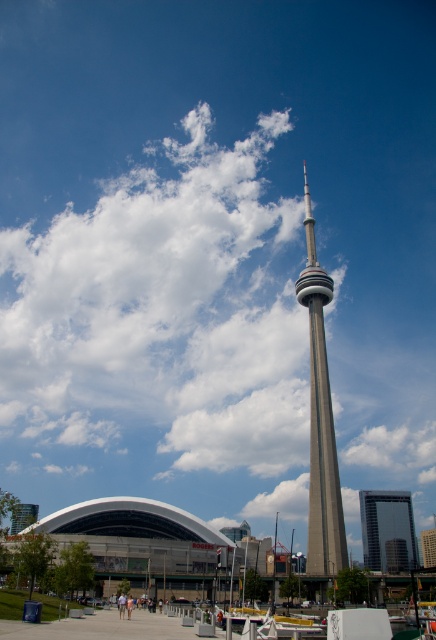
Question: Which point is closer to the camera?

Choices:
 (A) (392, 532)
 (B) (344, 541)
 (C) (210, 147)

Answer: (B)

Question: Can you confirm if white fluffy cloud at upper center is positioned below silver metallic cn tower at center?

Choices:
 (A) yes
 (B) no

Answer: (B)

Question: Which object is farther from the camera taking this photo?

Choices:
 (A) glassy reflective skyscraper at center
 (B) white fluffy cloud at upper center

Answer: (A)

Question: Does white fluffy cloud at upper center appear on the right side of glassy reflective skyscraper at center?

Choices:
 (A) yes
 (B) no

Answer: (B)

Question: Is white fluffy cloud at upper center positioned before glassy reflective skyscraper at center?

Choices:
 (A) no
 (B) yes

Answer: (B)

Question: Which object is the farthest from the silver metallic cn tower at center?

Choices:
 (A) glassy reflective skyscraper at center
 (B) white fluffy cloud at upper center

Answer: (A)